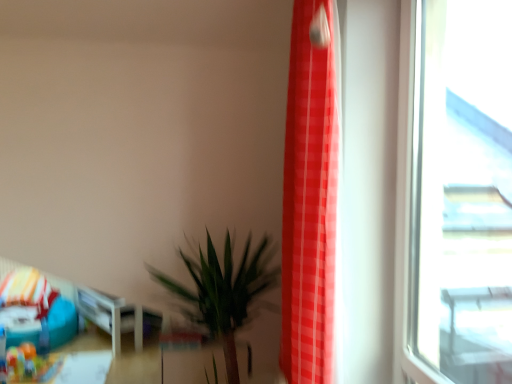
Describe the element at coordinates (310, 198) in the screenshot. I see `red checkered curtain at right` at that location.

Locate an element on the screen. teal fabric bean bag at lower left is located at coordinates [x=35, y=310].

Considering the relative sizes of teal fabric bean bag at lower left and red checkered curtain at right in the image provided, is teal fabric bean bag at lower left thinner than red checkered curtain at right?

No.

Does teal fabric bean bag at lower left appear on the right side of red checkered curtain at right?

Incorrect, teal fabric bean bag at lower left is not on the right side of red checkered curtain at right.

Consider the image. From the image's perspective, relative to red checkered curtain at right, is teal fabric bean bag at lower left above or below?

Based on their image positions, teal fabric bean bag at lower left is located beneath red checkered curtain at right.

From a real-world perspective, is teal fabric bean bag at lower left positioned under red checkered curtain at right based on gravity?

Correct, in the physical world, teal fabric bean bag at lower left is lower than red checkered curtain at right.

Would you say red checkered curtain at right is outside transparent glass window at right?

red checkered curtain at right is positioned outside transparent glass window at right.

Between point (296, 355) and point (446, 87), which one is positioned in front?

The point (296, 355) is closer.

From a real-world perspective, relative to transparent glass window at right, is red checkered curtain at right vertically above or below?

Clearly, from a real-world perspective, red checkered curtain at right is below transparent glass window at right.

Which object is further away from the camera taking this photo, red checkered curtain at right or transparent glass window at right?

red checkered curtain at right.

Considering the positions of objects teal fabric bean bag at lower left and green leafy plant at lower center in the image provided, who is more to the left, teal fabric bean bag at lower left or green leafy plant at lower center?

Positioned to the left is teal fabric bean bag at lower left.

Can you confirm if teal fabric bean bag at lower left is wider than green leafy plant at lower center?

Answer: Yes.

Is teal fabric bean bag at lower left facing away from green leafy plant at lower center?

No, teal fabric bean bag at lower left's orientation is not away from green leafy plant at lower center.

Considering the positions of objects teal fabric bean bag at lower left and green leafy plant at lower center in the image provided, who is behind, teal fabric bean bag at lower left or green leafy plant at lower center?

teal fabric bean bag at lower left is further from the camera.

Is transparent glass window at right situated inside red checkered curtain at right or outside?

transparent glass window at right is located beyond the bounds of red checkered curtain at right.

From the image's perspective, is transparent glass window at right below red checkered curtain at right?

Incorrect, from the image's perspective, transparent glass window at right is higher than red checkered curtain at right.

Is transparent glass window at right in front of or behind red checkered curtain at right in the image?

transparent glass window at right is in front of red checkered curtain at right.

Considering the sizes of red checkered curtain at right and green leafy plant at lower center in the image, is red checkered curtain at right taller or shorter than green leafy plant at lower center?

In the image, red checkered curtain at right appears to be taller than green leafy plant at lower center.

Is red checkered curtain at right bigger than green leafy plant at lower center?

No, red checkered curtain at right is not bigger than green leafy plant at lower center.

I want to click on houseplant behind the red checkered curtain at right, so click(x=222, y=292).

Which is nearer, (304,149) or (181,253)?

Point (304,149) is closer to the camera than point (181,253).

Is transparent glass window at right inside or outside of teal fabric bean bag at lower left?

transparent glass window at right is not enclosed by teal fabric bean bag at lower left.

In the scene shown: Is transparent glass window at right positioned with its back to teal fabric bean bag at lower left?

No, transparent glass window at right is not facing the opposite direction of teal fabric bean bag at lower left.

From a real-world perspective, is transparent glass window at right below teal fabric bean bag at lower left?

No, from a real-world perspective, transparent glass window at right is not below teal fabric bean bag at lower left.

Does transparent glass window at right have a greater height compared to green leafy plant at lower center?

Yes.

Is transparent glass window at right smaller than green leafy plant at lower center?

Yes, transparent glass window at right is smaller than green leafy plant at lower center.

Is the position of transparent glass window at right less distant than that of green leafy plant at lower center?

Yes, it is in front of green leafy plant at lower center.

Locate an element on the screen. This screenshot has width=512, height=384. curtain above the teal fabric bean bag at lower left (from the image's perspective) is located at coordinates (310, 198).

You are a GUI agent. You are given a task and a screenshot of the screen. Output one action in this format:
    pyautogui.click(x=<x>, y=<y>)
    Task: Click on the window above the red checkered curtain at right (from a real-world perspective)
    This screenshot has height=384, width=512.
    Given the screenshot: What is the action you would take?
    pyautogui.click(x=457, y=190)

Looking at the image, which one is located further to teal fabric bean bag at lower left, transparent glass window at right or green leafy plant at lower center?

transparent glass window at right is further to teal fabric bean bag at lower left.

Based on their spatial positions, is red checkered curtain at right or teal fabric bean bag at lower left closer to transparent glass window at right?

red checkered curtain at right lies closer to transparent glass window at right than the other object.

Which object lies further to the anchor point transparent glass window at right, teal fabric bean bag at lower left or green leafy plant at lower center?

teal fabric bean bag at lower left is further to transparent glass window at right.

When comparing their distances from red checkered curtain at right, does green leafy plant at lower center or transparent glass window at right seem further?

Based on the image, green leafy plant at lower center appears to be further to red checkered curtain at right.

Looking at this image, when comparing their distances from green leafy plant at lower center, does teal fabric bean bag at lower left or red checkered curtain at right seem closer?

red checkered curtain at right is positioned closer to the anchor green leafy plant at lower center.

Which object lies further to the anchor point teal fabric bean bag at lower left, transparent glass window at right or red checkered curtain at right?

transparent glass window at right is further to teal fabric bean bag at lower left.

When comparing their distances from green leafy plant at lower center, does transparent glass window at right or red checkered curtain at right seem closer?

Among the two, red checkered curtain at right is located nearer to green leafy plant at lower center.

From the image, which object appears to be farther from green leafy plant at lower center, red checkered curtain at right or teal fabric bean bag at lower left?

Among the two, teal fabric bean bag at lower left is located further to green leafy plant at lower center.

Locate an element on the screen. This screenshot has width=512, height=384. houseplant between red checkered curtain at right and teal fabric bean bag at lower left from front to back is located at coordinates (222, 292).

I want to click on curtain between teal fabric bean bag at lower left and transparent glass window at right, so click(310, 198).

Where is `curtain between green leafy plant at lower center and transparent glass window at right`? curtain between green leafy plant at lower center and transparent glass window at right is located at coordinates (310, 198).

Where is `houseplant between teal fabric bean bag at lower left and transparent glass window at right`? This screenshot has width=512, height=384. houseplant between teal fabric bean bag at lower left and transparent glass window at right is located at coordinates (222, 292).